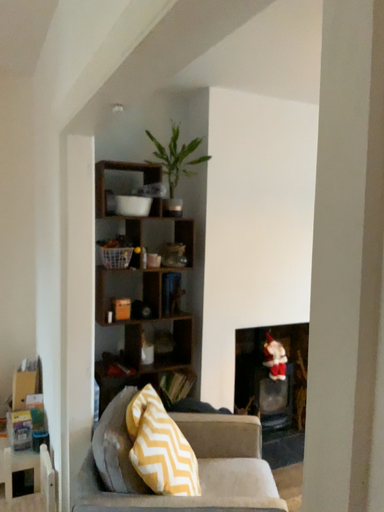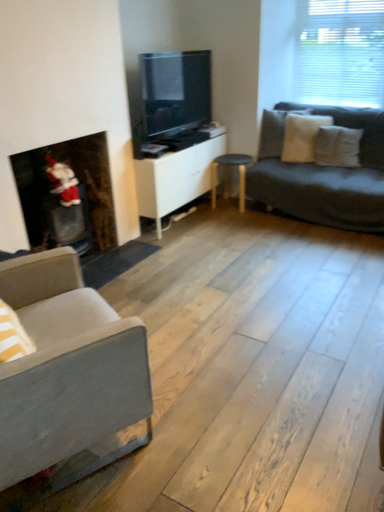
Question: Which way did the camera rotate in the video?

Choices:
 (A) rotated downward
 (B) rotated upward

Answer: (A)